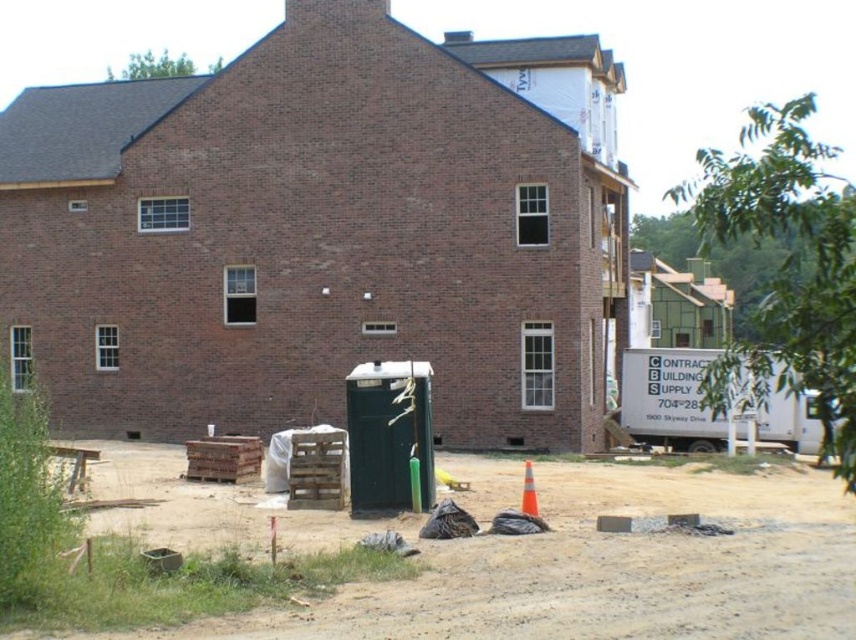
Can you confirm if dirt at lower center is smaller than orange reflective cone at lower center?

Incorrect, dirt at lower center is not smaller in size than orange reflective cone at lower center.

Measure the distance between point (846, 513) and camera.

15.63 meters

Image resolution: width=856 pixels, height=640 pixels. Identify the location of dirt at lower center. (536, 557).